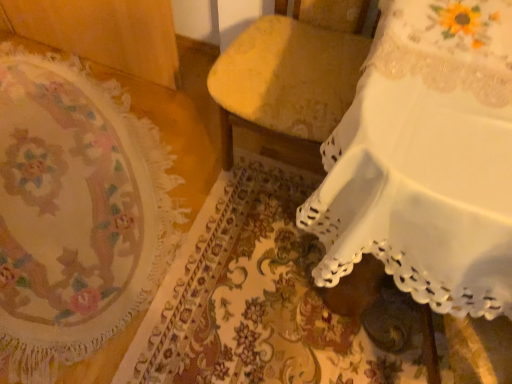
Image resolution: width=512 pixels, height=384 pixels. Identify the location of free space to the left of velvet yellow chair at center, which ranks as the first furniture in left-to-right order. (192, 125).